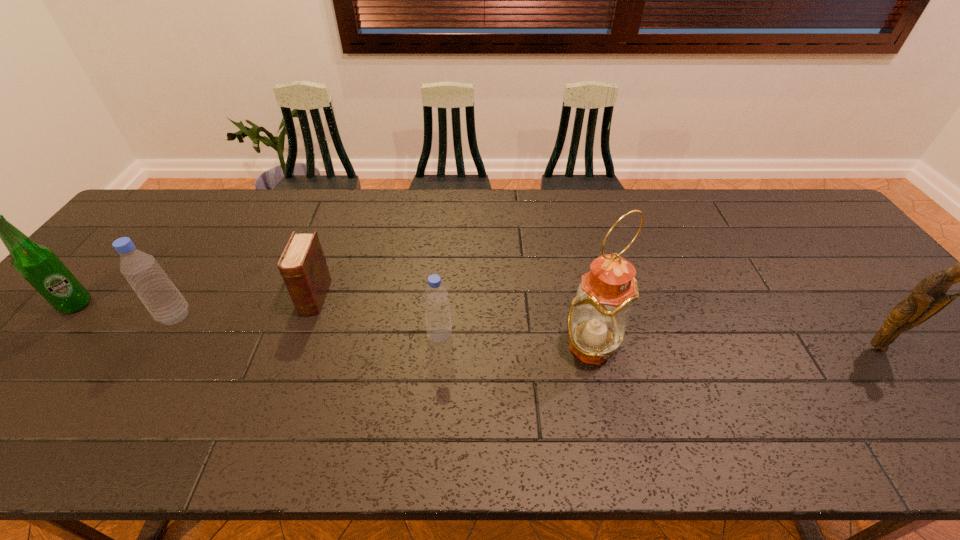
Find the location of a particular element. free space between the third object from left to right and the shorter bottle is located at coordinates (377, 316).

Where is `vacant point located between the fifth object from left to right and the rightmost object`? This screenshot has width=960, height=540. vacant point located between the fifth object from left to right and the rightmost object is located at coordinates (733, 346).

This screenshot has width=960, height=540. Find the location of `the third closest object to the fourth object from left to right`. the third closest object to the fourth object from left to right is located at coordinates (165, 303).

What are the coordinates of `the fifth closest object to the shortest object` in the screenshot? It's located at (929, 297).

The height and width of the screenshot is (540, 960). I want to click on free point that satisfies the following two spatial constraints: 1. on the spine side of the right bottle; 2. on the left side of the shortest object, so click(300, 336).

I want to click on free location that satisfies the following two spatial constraints: 1. on the spine side of the fifth object from left to right; 2. on the left side of the shortest object, so pos(298,346).

The height and width of the screenshot is (540, 960). I want to click on free region that satisfies the following two spatial constraints: 1. on the front side of the left bottle; 2. on the right side of the third object from right to left, so click(x=163, y=336).

This screenshot has width=960, height=540. Find the location of `vacant space that satisfies the following two spatial constraints: 1. on the label of the fifth object from left to right; 2. on the left side of the leftmost object`. vacant space that satisfies the following two spatial constraints: 1. on the label of the fifth object from left to right; 2. on the left side of the leftmost object is located at coordinates (40, 346).

At what (x,y) coordinates should I click in order to perform the action: click on vacant position in the image that satisfies the following two spatial constraints: 1. on the label of the right bottle; 2. on the left side of the leftmost object. Please return your answer as a coordinate pair (x, y). Looking at the image, I should click on (49, 336).

Find the location of a particular element. This screenshot has height=540, width=960. free space that satisfies the following two spatial constraints: 1. on the back side of the taller bottle; 2. on the label of the beer bottle is located at coordinates (183, 305).